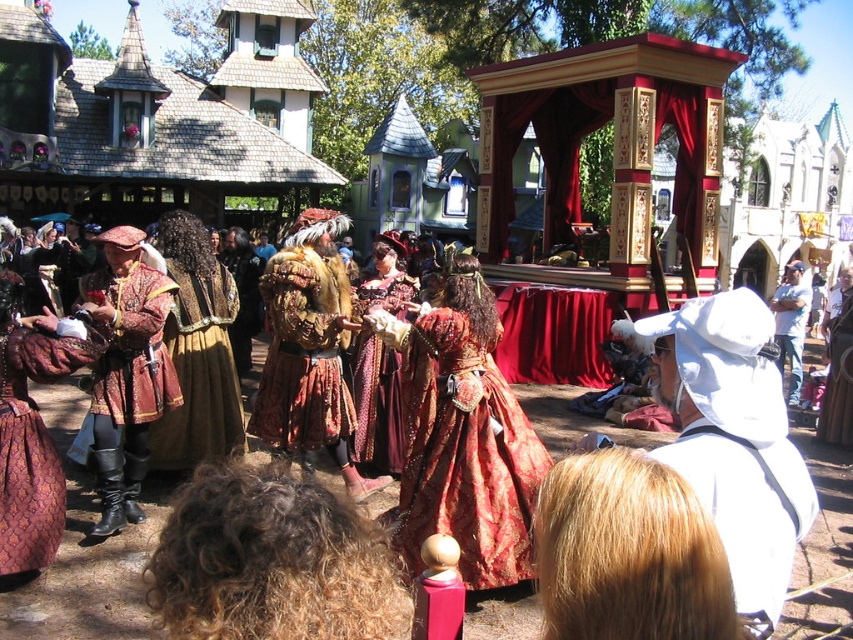
Question: Is matte red dress at center bigger than matte gold dress at center?

Choices:
 (A) yes
 (B) no

Answer: (A)

Question: Estimate the real-world distances between objects in this image. Which object is closer to the matte red dress at center?

Choices:
 (A) shiny gold dress at center
 (B) velvet maroon dress at center
 (C) matte gold dress at center

Answer: (C)

Question: Which object appears closest to the camera in this image?

Choices:
 (A) white cotton hat at right
 (B) velvet maroon dress at center
 (C) shiny gold dress at center

Answer: (A)

Question: Is shiny gold dress at center above velvet maroon dress at center?

Choices:
 (A) no
 (B) yes

Answer: (A)

Question: Is the position of matte gold dress at center more distant than that of white cotton hat at right?

Choices:
 (A) yes
 (B) no

Answer: (A)

Question: Which point appears closest to the camera in this image?

Choices:
 (A) (792, 324)
 (B) (196, 440)
 (C) (378, 461)

Answer: (B)